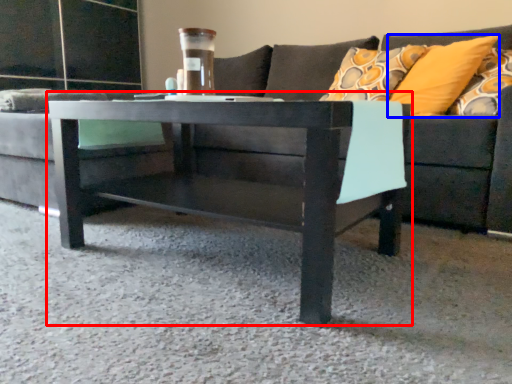
Question: Which object appears farthest to the camera in this image, coffee table (highlighted by a red box) or pillow (highlighted by a blue box)?

Choices:
 (A) coffee table
 (B) pillow

Answer: (B)